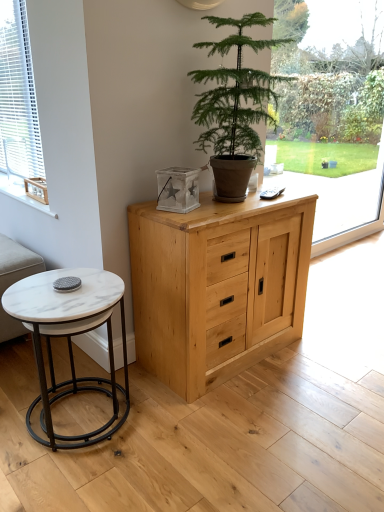
Question: Is white marble coffee table at lower left a part of beige fabric couch at lower left?

Choices:
 (A) yes
 (B) no

Answer: (B)

Question: Is beige fabric couch at lower left thinner than white marble coffee table at lower left?

Choices:
 (A) yes
 (B) no

Answer: (A)

Question: Is beige fabric couch at lower left placed right next to white marble coffee table at lower left?

Choices:
 (A) yes
 (B) no

Answer: (B)

Question: From a real-world perspective, is beige fabric couch at lower left physically below white marble coffee table at lower left?

Choices:
 (A) no
 (B) yes

Answer: (B)

Question: From the image's perspective, does beige fabric couch at lower left appear lower than white marble coffee table at lower left?

Choices:
 (A) yes
 (B) no

Answer: (B)

Question: Is beige fabric couch at lower left facing away from white marble coffee table at lower left?

Choices:
 (A) no
 (B) yes

Answer: (A)

Question: Does white marble coffee table at lower left turn towards transparent glass window at center?

Choices:
 (A) no
 (B) yes

Answer: (A)

Question: From a real-world perspective, does white marble coffee table at lower left stand above transparent glass window at center?

Choices:
 (A) yes
 (B) no

Answer: (B)

Question: Considering the relative sizes of white marble coffee table at lower left and transparent glass window at center in the image provided, is white marble coffee table at lower left taller than transparent glass window at center?

Choices:
 (A) yes
 (B) no

Answer: (B)

Question: Would you say transparent glass window at center is part of white marble coffee table at lower left's contents?

Choices:
 (A) yes
 (B) no

Answer: (B)

Question: Is white marble coffee table at lower left next to transparent glass window at center and touching it?

Choices:
 (A) no
 (B) yes

Answer: (A)

Question: From the image's perspective, is white marble coffee table at lower left over transparent glass window at center?

Choices:
 (A) yes
 (B) no

Answer: (B)

Question: Considering the relative sizes of white blinds at left and wooden crate at left in the image provided, is white blinds at left bigger than wooden crate at left?

Choices:
 (A) yes
 (B) no

Answer: (A)